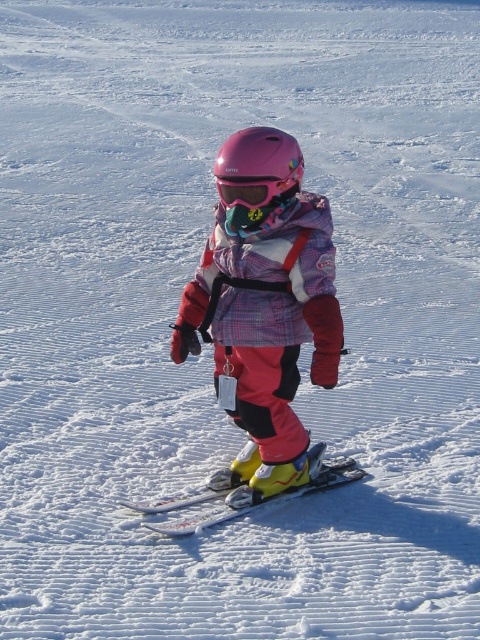
At what (x,y) coordinates should I click in order to perform the action: click on pink matte helmet at center. Please return your answer as a coordinate pair (x, y). This screenshot has height=640, width=480. Looking at the image, I should click on (256, 177).

Is point (245, 179) positioned before point (224, 180)?

Yes.

Locate an element on the screen. Image resolution: width=480 pixels, height=640 pixels. pink matte helmet at center is located at coordinates (256, 177).

Who is more forward, (248, 452) or (291, 172)?

Point (291, 172)

You are a GUI agent. You are given a task and a screenshot of the screen. Output one action in this format:
    pyautogui.click(x=<x>, y=<y>)
    Task: Click on the matte pink helmet at center
    The width and height of the screenshot is (480, 640).
    Given the screenshot: What is the action you would take?
    pyautogui.click(x=264, y=301)

Which is above, matte pink helmet at center or yellow matte ski at center?

Positioned higher is matte pink helmet at center.

Is matte pink helmet at center wider than yellow matte ski at center?

No, matte pink helmet at center is not wider than yellow matte ski at center.

This screenshot has width=480, height=640. I want to click on matte pink helmet at center, so click(x=264, y=301).